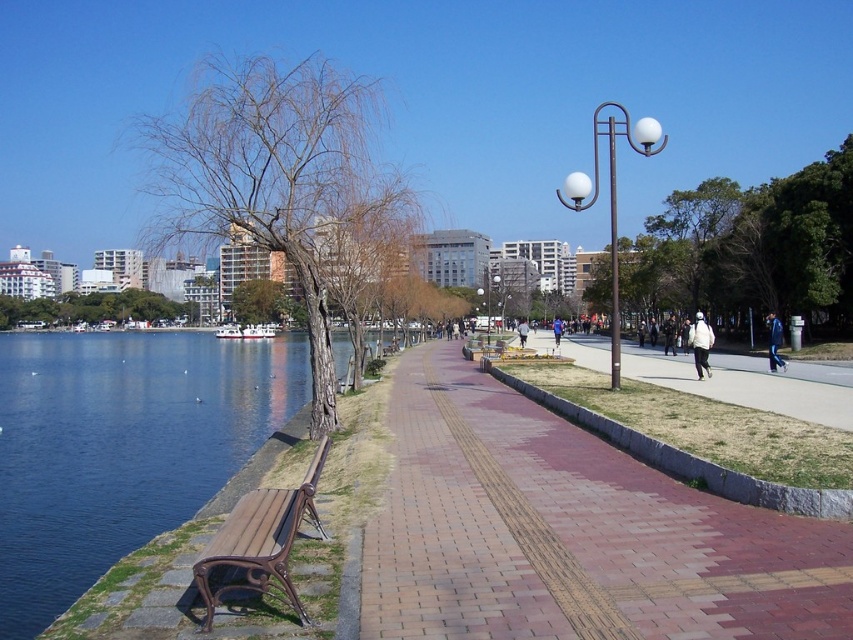
Question: Can you confirm if bare wood tree at left is thinner than white cotton jacket at center-right?

Choices:
 (A) no
 (B) yes

Answer: (A)

Question: From the image, what is the correct spatial relationship of bare wood tree at left in relation to wooden bench at lower left?

Choices:
 (A) right
 (B) left

Answer: (B)

Question: Can you confirm if brown wood tree at center is positioned to the right of white cotton jacket at center?

Choices:
 (A) no
 (B) yes

Answer: (A)

Question: Which of the following is the closest to the observer?

Choices:
 (A) white matte jacket at center
 (B) brick paved pathway at center

Answer: (B)

Question: Which object is the closest to the brick paved pathway at center?

Choices:
 (A) brick paved sidewalk at center
 (B) matte black lamp post at center
 (C) blue fabric jacket at right
 (D) brown wood tree at center

Answer: (A)

Question: Estimate the real-world distances between objects in this image. Which object is closer to the green leafy tree at center?

Choices:
 (A) clear blue water at bench left
 (B) white cotton jacket at center-right

Answer: (B)